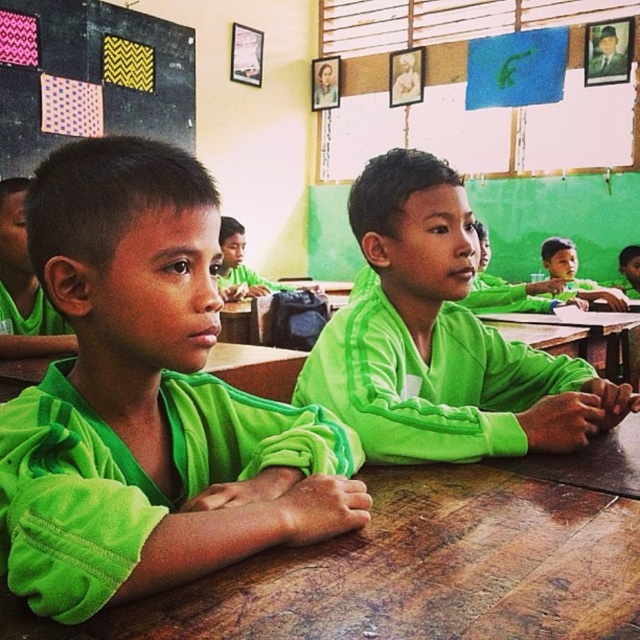
You are a teacher in the classroom and need to retrieve both jackets. The space between the green fleece jacket at center and the green matte jacket at left is 1.19 meters. If you have a hanger that is 1.2 meters long, can you hang both jackets on the same hanger without them overlapping?

The distance between the green fleece jacket at center and the green matte jacket at left is 1.19 meters. Since the hanger is 1.2 meters long, which is slightly longer than the space between them, you can hang both jackets on the same hanger without overlapping.

In the classroom scene, there are two children wearing green uniforms. One has a green matte jacket at center and the other has a green fabric shirt at center. Which child is sitting to the left of the other?

The green matte jacket at center is to the left of the green fabric shirt at center, so the child wearing the green matte jacket at center is sitting to the left of the child wearing the green fabric shirt at center.